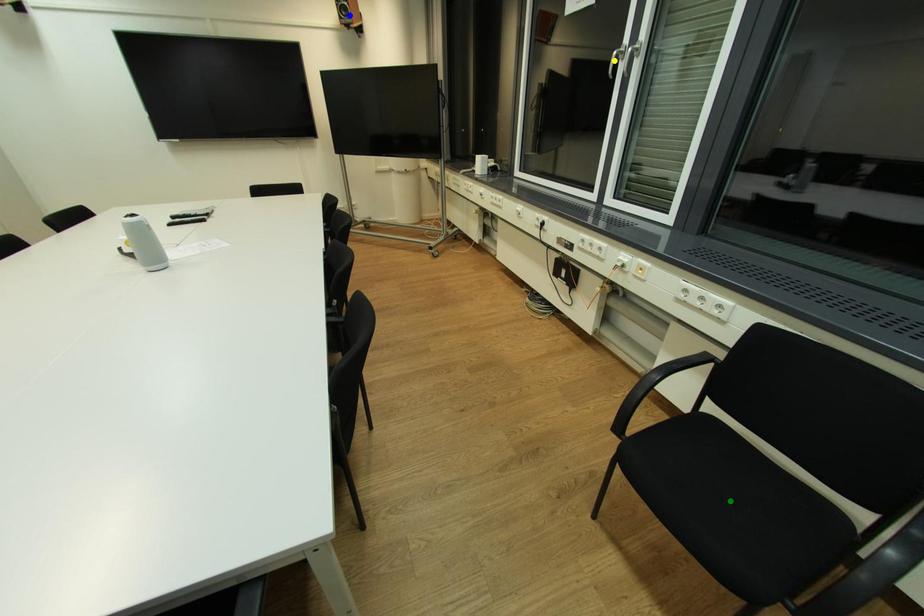
Order these from nearest to farthest:
blue point, yellow point, green point

blue point < yellow point < green point